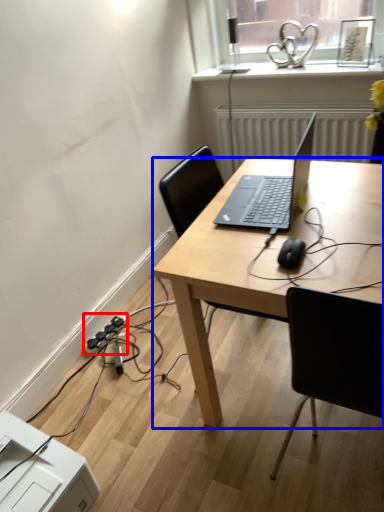
Question: Which object is further to the camera taking this photo, extension cord (highlighted by a red box) or desk (highlighted by a blue box)?

Choices:
 (A) extension cord
 (B) desk

Answer: (A)